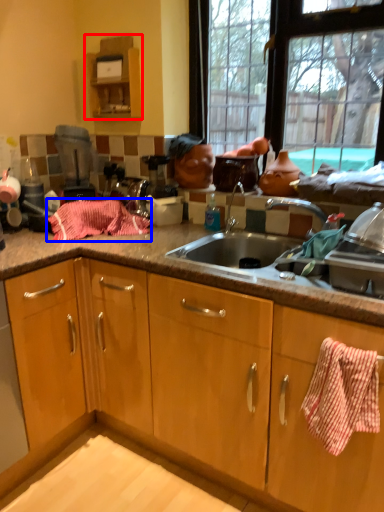
Question: Among these objects, which one is farthest to the camera, cabinetry (highlighted by a red box) or blanket (highlighted by a blue box)?

Choices:
 (A) cabinetry
 (B) blanket

Answer: (A)